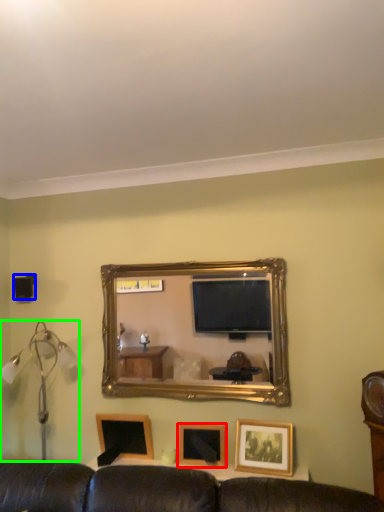
Question: Considering the real-world distances, which object is closest to picture frame (highlighted by a red box)? speaker (highlighted by a blue box) or table lamp (highlighted by a green box).

Choices:
 (A) speaker
 (B) table lamp

Answer: (B)